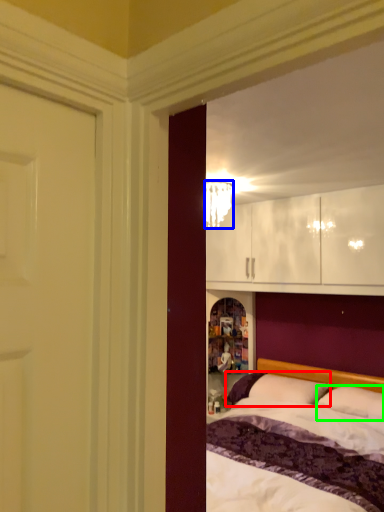
Question: Which is nearer to the pillow (highlighted by a red box)? lamp (highlighted by a blue box) or pillow (highlighted by a green box).

Choices:
 (A) lamp
 (B) pillow

Answer: (B)